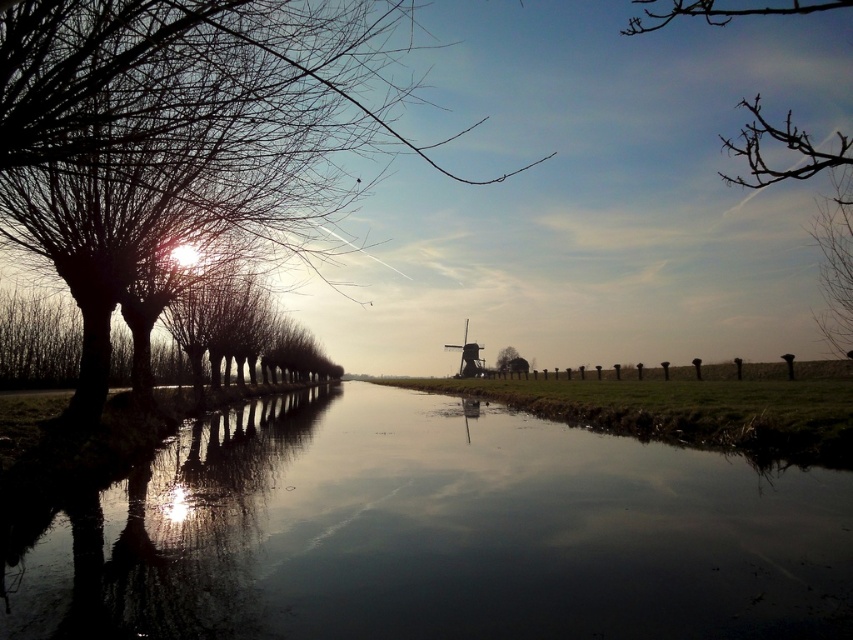
Between silhouette bare tree at left and green matte tree at center, which one has less height?

With less height is green matte tree at center.

Between point (335, 108) and point (498, 368), which one is positioned behind?

Point (498, 368)

Between point (207, 49) and point (514, 352), which one is positioned in front?

Point (207, 49) is more forward.

Find the location of a particular element. This screenshot has width=853, height=640. silhouette bare tree at left is located at coordinates (163, 131).

Between smooth reflective water at center and silhouette bare tree at left, which one is positioned higher?

silhouette bare tree at left

The image size is (853, 640). What do you see at coordinates (434, 532) in the screenshot? I see `smooth reflective water at center` at bounding box center [434, 532].

Is point (202, 467) closer to camera compared to point (318, 163)?

No, (202, 467) is further to viewer.

This screenshot has width=853, height=640. I want to click on smooth reflective water at center, so click(x=434, y=532).

Does silhouette bare tree at left have a larger size compared to bare branches at upper right?

Actually, silhouette bare tree at left might be smaller than bare branches at upper right.

In the scene shown: Who is positioned more to the right, silhouette bare tree at left or bare branches at upper right?

Positioned to the right is bare branches at upper right.

Between point (236, 19) and point (844, 166), which one is positioned behind?

The point (844, 166) is behind.

Locate an element on the screen. The image size is (853, 640). silhouette bare tree at left is located at coordinates (163, 131).